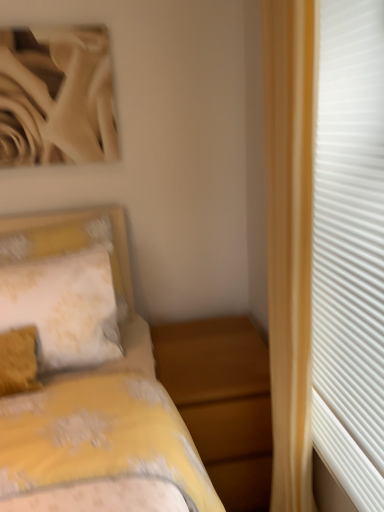
What is the approximate height of white textured curtain at right?

It is 1.17 meters.

This screenshot has height=512, width=384. Describe the element at coordinates (326, 244) in the screenshot. I see `white textured curtain at right` at that location.

This screenshot has width=384, height=512. What are the coordinates of `matte wood nightstand at lower center` in the screenshot? It's located at (222, 402).

Where is `yellow floral fabric pillow at left`? Image resolution: width=384 pixels, height=512 pixels. yellow floral fabric pillow at left is located at coordinates (64, 307).

The width and height of the screenshot is (384, 512). What are the coordinates of `pillow that is above the matte wood nightstand at lower center (from a real-world perspective)` in the screenshot? It's located at (64, 307).

Based on the photo, is matte wood nightstand at lower center behind yellow floral fabric pillow at left?

No, the depth of matte wood nightstand at lower center is less than that of yellow floral fabric pillow at left.

From the image's perspective, is matte wood nightstand at lower center positioned above or below yellow floral fabric pillow at left?

Clearly, from the image's perspective, matte wood nightstand at lower center is below yellow floral fabric pillow at left.

From a real-world perspective, who is located higher, matte wood nightstand at lower center or yellow floral fabric pillow at left?

From a 3D spatial view, yellow floral fabric pillow at left is above.

Does matte wood nightstand at lower center have a smaller size compared to white textured curtain at right?

No.

Considering the positions of objects matte wood nightstand at lower center and white textured curtain at right in the image provided, who is more to the right, matte wood nightstand at lower center or white textured curtain at right?

white textured curtain at right is more to the right.

From the image's perspective, is matte wood nightstand at lower center located above or below white textured curtain at right?

Based on their image positions, matte wood nightstand at lower center is located beneath white textured curtain at right.

Considering the sizes of objects matte wood nightstand at lower center and white textured curtain at right in the image provided, who is shorter, matte wood nightstand at lower center or white textured curtain at right?

Standing shorter between the two is matte wood nightstand at lower center.

Is the surface of white textured curtain at right in direct contact with matte wood nightstand at lower center?

No, white textured curtain at right is not making contact with matte wood nightstand at lower center.

Is white textured curtain at right facing towards matte wood nightstand at lower center?

No, white textured curtain at right does not turn towards matte wood nightstand at lower center.

Which is correct: white textured curtain at right is inside matte wood nightstand at lower center, or outside of it?

white textured curtain at right is outside matte wood nightstand at lower center.

Between point (359, 269) and point (248, 423), which one is positioned in front?

The point (359, 269) is more forward.

Does point (297, 497) come behind point (22, 289)?

No, (297, 497) is in front of (22, 289).

Which object is further away from the camera, white textured curtain at right or yellow floral fabric pillow at left?

yellow floral fabric pillow at left is further away from the camera.

From the image's perspective, which object appears higher, white textured curtain at right or yellow floral fabric pillow at left?

white textured curtain at right, from the image's perspective.

Which is behind, yellow floral fabric pillow at left or matte wood nightstand at lower center?

Positioned behind is yellow floral fabric pillow at left.

Between point (72, 361) and point (251, 360), which one is positioned in front?

The point (72, 361) is closer.

Is yellow floral fabric pillow at left at the right side of matte wood nightstand at lower center?

No, yellow floral fabric pillow at left is not to the right of matte wood nightstand at lower center.

Which object is wider, yellow floral fabric pillow at left or white textured curtain at right?

yellow floral fabric pillow at left.

How distant is yellow floral fabric pillow at left from white textured curtain at right?

yellow floral fabric pillow at left and white textured curtain at right are 63.61 centimeters apart.

Looking at this image, from the image's perspective, between yellow floral fabric pillow at left and white textured curtain at right, which one is located above?

white textured curtain at right appears higher in the image.

Who is bigger, yellow floral fabric pillow at left or white textured curtain at right?

white textured curtain at right is bigger.

Find the location of a particular element. The height and width of the screenshot is (512, 384). nightstand below the yellow floral fabric pillow at left (from the image's perspective) is located at coordinates (222, 402).

What are the coordinates of `nightstand below the white textured curtain at right (from a real-world perspective)` in the screenshot? It's located at (222, 402).

Estimate the real-world distances between objects in this image. Which object is closer to matte wood nightstand at lower center, yellow floral fabric pillow at left or white textured curtain at right?

Among the two, yellow floral fabric pillow at left is located nearer to matte wood nightstand at lower center.

When comparing their distances from white textured curtain at right, does matte wood nightstand at lower center or yellow floral fabric pillow at left seem closer?

Based on the image, matte wood nightstand at lower center appears to be nearer to white textured curtain at right.

Based on their spatial positions, is yellow floral fabric pillow at left or matte wood nightstand at lower center closer to white textured curtain at right?

matte wood nightstand at lower center is closer to white textured curtain at right.

In the scene shown: Based on their spatial positions, is white textured curtain at right or matte wood nightstand at lower center further from yellow floral fabric pillow at left?

white textured curtain at right is further to yellow floral fabric pillow at left.

Estimate the real-world distances between objects in this image. Which object is further from yellow floral fabric pillow at left, matte wood nightstand at lower center or white textured curtain at right?

white textured curtain at right lies further to yellow floral fabric pillow at left than the other object.

Estimate the real-world distances between objects in this image. Which object is closer to matte wood nightstand at lower center, white textured curtain at right or yellow floral fabric pillow at left?

Among the two, yellow floral fabric pillow at left is located nearer to matte wood nightstand at lower center.

You are a GUI agent. You are given a task and a screenshot of the screen. Output one action in this format:
    pyautogui.click(x=<x>, y=<y>)
    Task: Click on the nightstand between white textured curtain at right and yellow floral fabric pillow at left in the front-back direction
    This screenshot has width=384, height=512.
    Given the screenshot: What is the action you would take?
    pyautogui.click(x=222, y=402)